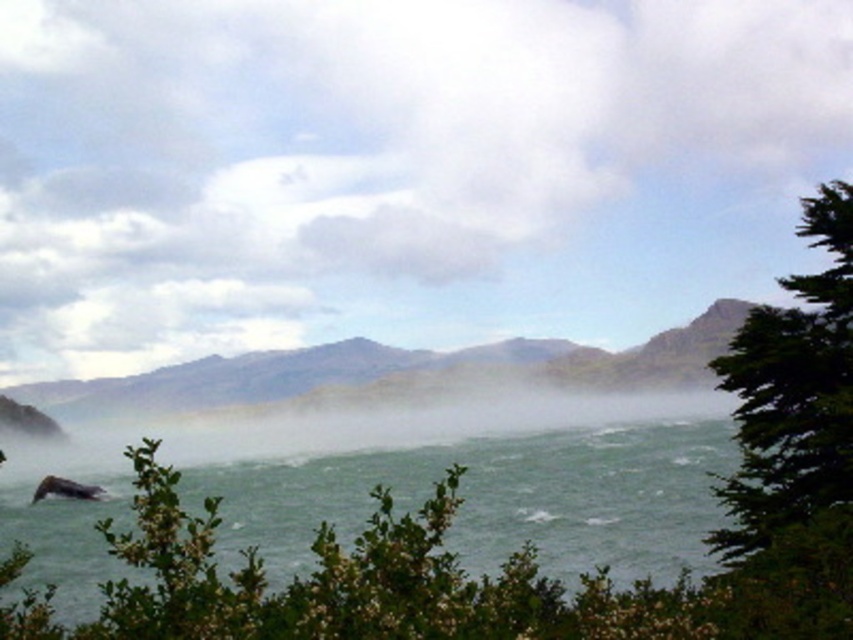
You are a photographer standing at the center of the scene. You want to capture the green rough water at lower left in your shot. Based on its coordinates, where should you position your camera to ensure it is centered in the frame?

The green rough water at lower left is located at coordinates point [390,493]. To center it in your camera frame, position the camera so that the crosshairs align with those coordinates.

You are an outdoor adventurer planning to take a photo of the rugged rock mountain at center and the green leafy tree at right. Based on their sizes in the scene, which object would appear wider in the photo?

The rugged rock mountain at center would appear wider in the photo because its width surpasses that of the green leafy tree at right.

You are a hiker planning to cross from the green rough water at lower left to the rugged rock mountain at center. Considering their heights, which one is lower and would be easier to navigate?

The green rough water at lower left has a lesser height compared to rugged rock mountain at center, so it is lower and easier to navigate.